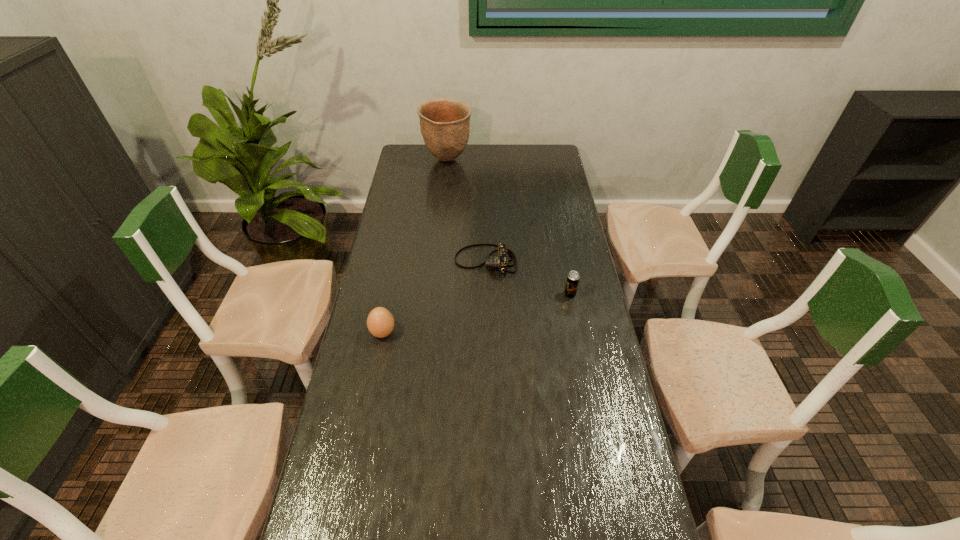
Locate an element on the screen. The width and height of the screenshot is (960, 540). vacant area that satisfies the following two spatial constraints: 1. on the front-facing side of the beer can; 2. on the left side of the camera is located at coordinates (486, 294).

The image size is (960, 540). I want to click on free spot that satisfies the following two spatial constraints: 1. on the front-facing side of the second farthest object; 2. on the left side of the rightmost object, so [x=486, y=294].

Find the location of a particular element. The width and height of the screenshot is (960, 540). vacant point that satisfies the following two spatial constraints: 1. on the front-facing side of the beer can; 2. on the left side of the camera is located at coordinates (486, 294).

Find the location of a particular element. vacant area in the image that satisfies the following two spatial constraints: 1. on the front-facing side of the shortest object; 2. on the right side of the rightmost object is located at coordinates (486, 294).